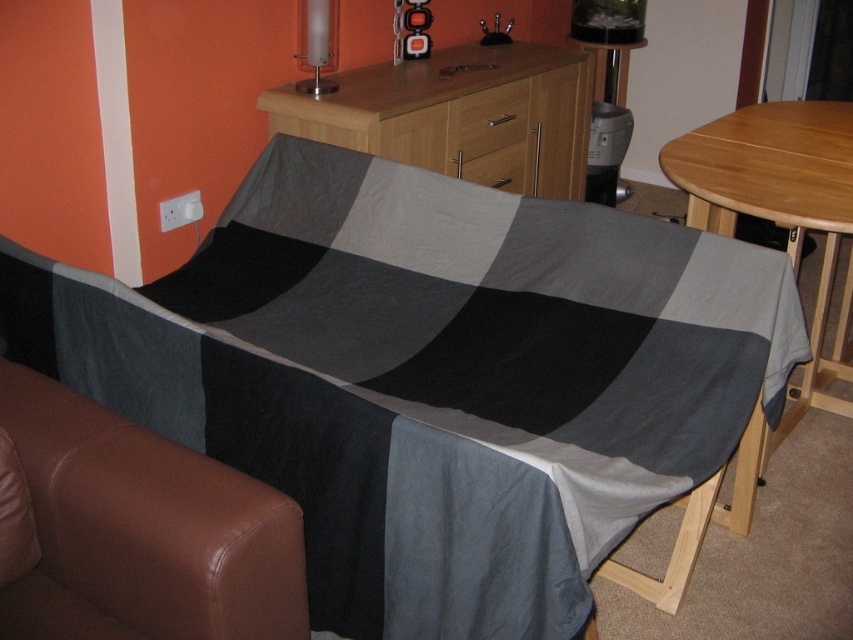
You are standing in the living room and want to place a small decoration on the wooden table. The table has two points marked at coordinates point (467, 70) and point (488, 154). Which point is closer to you if you are facing the table directly?

Point (467, 70) is closer to the camera than point (488, 154), so if you are facing the table directly, point (467, 70) is closer to you.

You are trying to place a 6 inch wide decorative item between the beech wood dresser at center and the matte wood drawer at center. Is there enough space?

The beech wood dresser at center is 7.16 inches from matte wood drawer at center, so yes, a 6 inch wide decorative item can fit between them since the distance is greater than the item width.

You are sitting in the brown leather armchair at lower left and want to reach the matte glass lampshade at upper center. Which direction should you turn to face it?

You should turn to your right to face the matte glass lampshade at upper center since the brown leather armchair at lower left is to the left of it.